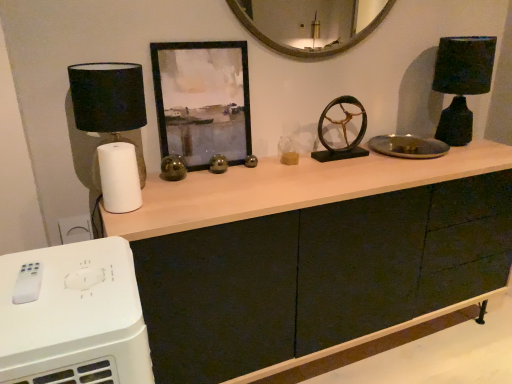
In order to click on free space to the left of bronze metallic wheel at center in this screenshot , I will do `click(296, 162)`.